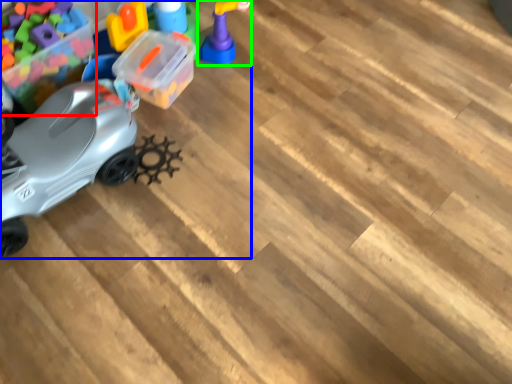
Question: Which object is the farthest from toy (highlighted by a red box)? Choose among these: toy (highlighted by a blue box) or toy (highlighted by a green box).

Choices:
 (A) toy
 (B) toy

Answer: (B)